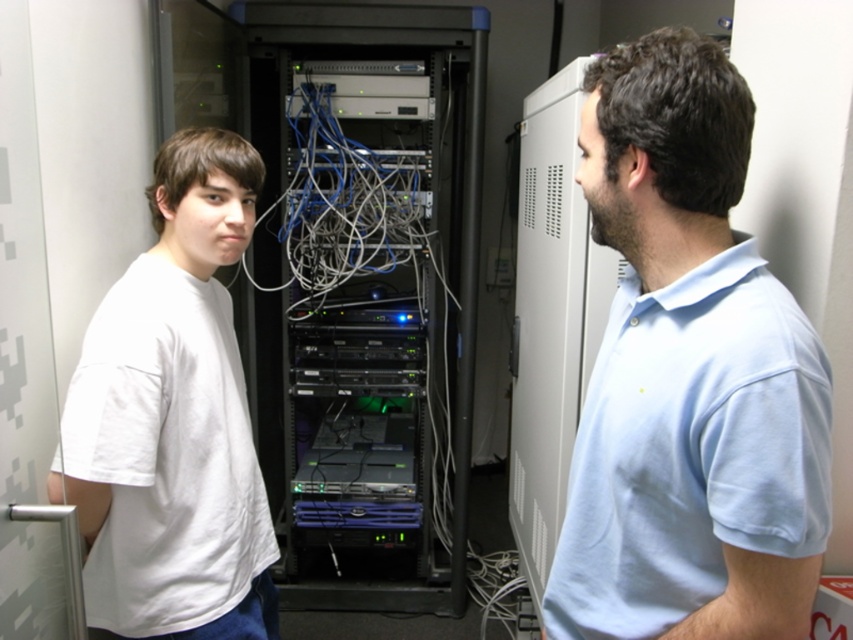
Describe the element at coordinates (688, 376) in the screenshot. This screenshot has width=853, height=640. I see `light blue cotton shirt at center` at that location.

Does light blue cotton shirt at center have a smaller size compared to white cotton t-shirt at left?

Yes.

Is point (788, 410) positioned behind point (222, 211)?

No, (788, 410) is closer to viewer.

Where is `light blue cotton shirt at center`? This screenshot has width=853, height=640. light blue cotton shirt at center is located at coordinates (688, 376).